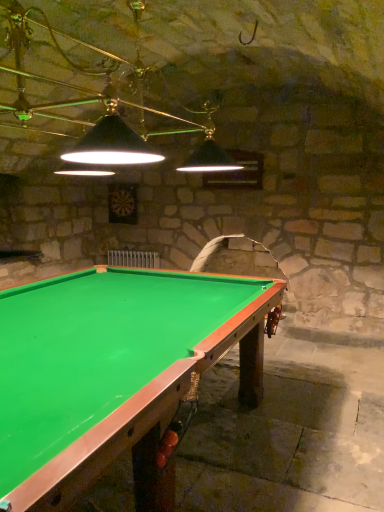
Question: From the image's perspective, is black matte lampshade at upper center above or below green felt billiard table at center?

Choices:
 (A) below
 (B) above

Answer: (B)

Question: Is black matte lampshade at upper center inside or outside of green felt billiard table at center?

Choices:
 (A) outside
 (B) inside

Answer: (A)

Question: Is point (102, 80) positioned closer to the camera than point (162, 330)?

Choices:
 (A) farther
 (B) closer

Answer: (A)

Question: From a real-world perspective, relative to black matte lampshade at upper center, is green felt billiard table at center vertically above or below?

Choices:
 (A) above
 (B) below

Answer: (B)

Question: From the image's perspective, is green felt billiard table at center located above or below black matte lampshade at upper center?

Choices:
 (A) below
 (B) above

Answer: (A)

Question: Does point (96, 426) appear closer or farther from the camera than point (145, 69)?

Choices:
 (A) farther
 (B) closer

Answer: (B)

Question: Looking at their shapes, would you say green felt billiard table at center is wider or thinner than black matte lampshade at upper center?

Choices:
 (A) wide
 (B) thin

Answer: (A)